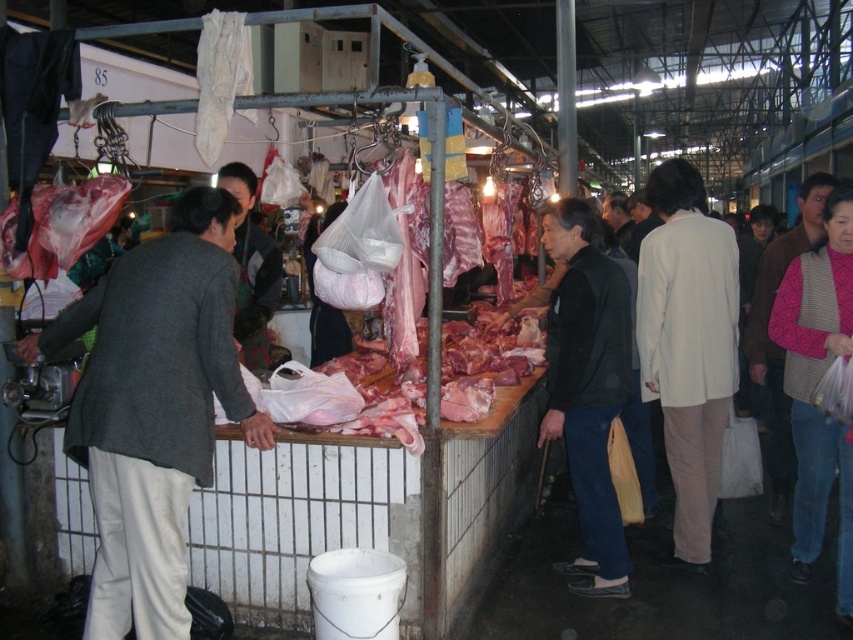
Question: Which of the following is the farthest from the observer?

Choices:
 (A) pink knitted sweater at right
 (B) black matte jacket at center

Answer: (A)

Question: Which is farther from the white matte jacket at right?

Choices:
 (A) black matte jacket at center
 (B) pink knitted sweater at right

Answer: (B)

Question: Is white matte jacket at right wider than pink knitted sweater at right?

Choices:
 (A) yes
 (B) no

Answer: (B)

Question: Does black matte jacket at center appear on the right side of pink knitted sweater at right?

Choices:
 (A) yes
 (B) no

Answer: (B)

Question: Does black matte jacket at center come in front of dark gray sweater at center?

Choices:
 (A) no
 (B) yes

Answer: (A)

Question: Which point appears farthest from the camera in this image?

Choices:
 (A) (610, 525)
 (B) (677, 406)
 (C) (111, 385)

Answer: (B)